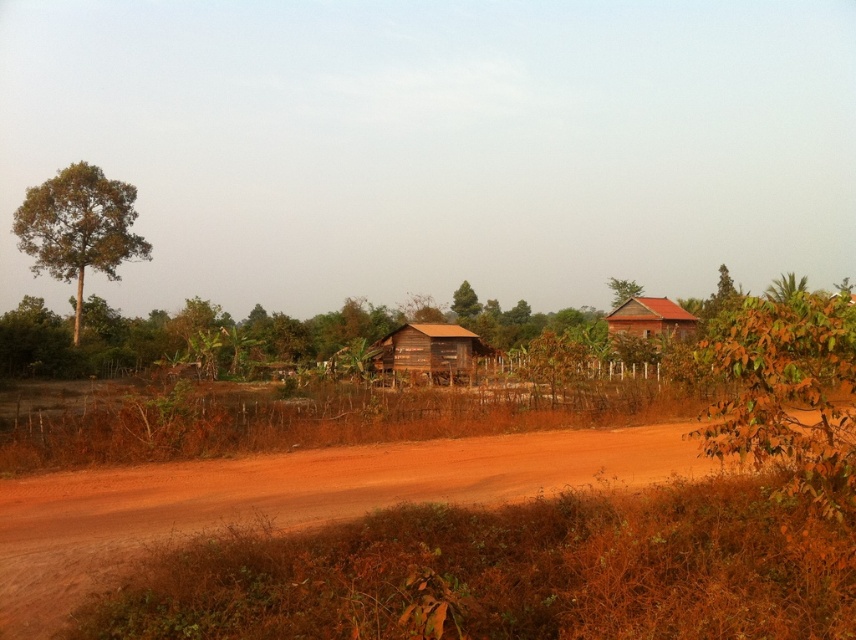
Question: Is green leafy tree at left wider than green leafy tree at upper center?

Choices:
 (A) no
 (B) yes

Answer: (A)

Question: Estimate the real-world distances between objects in this image. Which object is closer to the green leafy tree at left?

Choices:
 (A) brown leafy tree at right
 (B) brown dirt field at center
 (C) green leafy tree at upper center

Answer: (B)

Question: Does brown dirt field at center appear under brown leafy tree at right?

Choices:
 (A) no
 (B) yes

Answer: (B)

Question: Does red clay hut at right have a lesser width compared to green leafy tree at upper center?

Choices:
 (A) yes
 (B) no

Answer: (A)

Question: Which point appears farthest from the camera in this image?

Choices:
 (A) (467, 288)
 (B) (646, 340)
 (C) (435, 353)

Answer: (A)

Question: Which of the following is the closest to the observer?

Choices:
 (A) (92, 173)
 (B) (670, 312)
 (C) (455, 301)
 (D) (782, 380)

Answer: (D)